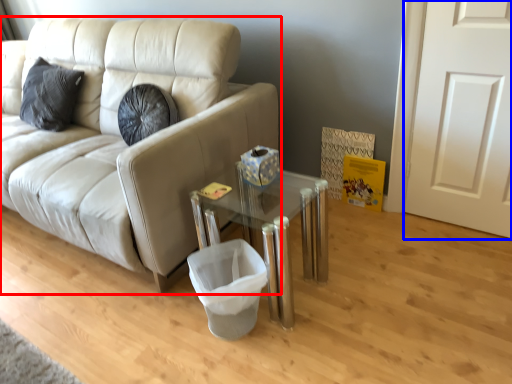
Question: Which of the following is the farthest to the observer, studio couch (highlighted by a red box) or door (highlighted by a blue box)?

Choices:
 (A) studio couch
 (B) door

Answer: (B)